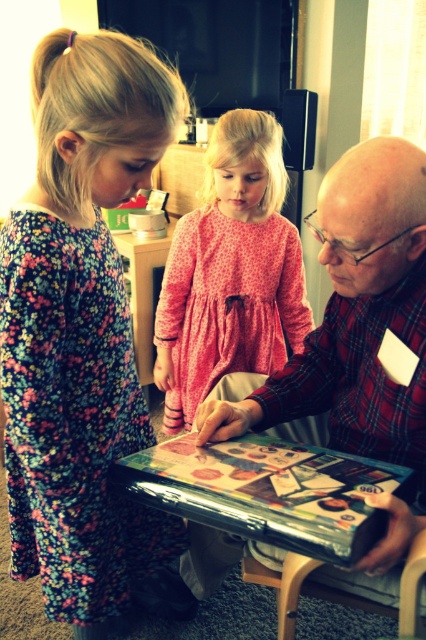
Is floral dress at left above pink dotted dress at center?

Incorrect, floral dress at left is not positioned above pink dotted dress at center.

Is point (68, 298) farther from camera compared to point (169, 392)?

No, it is not.

Who is more forward, (104, 547) or (161, 326)?

Point (104, 547) is more forward.

The image size is (426, 640). I want to click on floral dress at left, so click(x=80, y=328).

Between pink dotted dress at center and metallic/reflective table at center, which one is positioned higher?

pink dotted dress at center is above.

Consider the image. Does pink dotted dress at center have a greater height compared to metallic/reflective table at center?

Yes.

Find the location of `pink dotted dress at center`. pink dotted dress at center is located at coordinates (230, 272).

Where is `pink dotted dress at center`? pink dotted dress at center is located at coordinates (230, 272).

The image size is (426, 640). What do you see at coordinates (80, 328) in the screenshot?
I see `floral dress at left` at bounding box center [80, 328].

The width and height of the screenshot is (426, 640). I want to click on floral dress at left, so click(x=80, y=328).

Locate an element on the screen. This screenshot has width=426, height=640. floral dress at left is located at coordinates (80, 328).